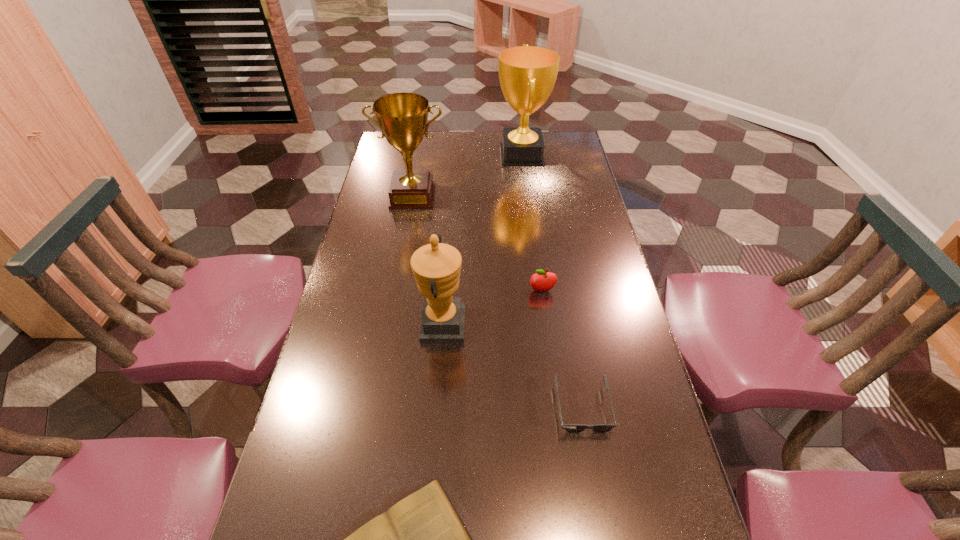
Locate an element on the screen. the rightmost award is located at coordinates (527, 74).

Image resolution: width=960 pixels, height=540 pixels. Find the location of `the farthest award`. the farthest award is located at coordinates [527, 74].

Identify the location of the second farthest award. This screenshot has height=540, width=960. (402, 117).

At what (x,y) coordinates should I click in order to perform the action: click on the fourth farthest object. Please return your answer as a coordinate pair (x, y). The width and height of the screenshot is (960, 540). Looking at the image, I should click on (436, 266).

You are a GUI agent. You are given a task and a screenshot of the screen. Output one action in this format:
    pyautogui.click(x=<x>, y=<y>)
    Task: Click on the third farthest object
    
    Given the screenshot: What is the action you would take?
    pyautogui.click(x=542, y=280)

The width and height of the screenshot is (960, 540). Identify the location of apple. (542, 280).

This screenshot has height=540, width=960. What are the coordinates of `sunglasses` in the screenshot? It's located at (x=571, y=428).

The image size is (960, 540). What are the coordinates of `the fifth tallest object` in the screenshot? It's located at (571, 428).

At what (x,y) coordinates should I click in order to perform the action: click on free space located 0.190m on the front-facing side of the farthest award. Please return your answer as a coordinate pair (x, y). Looking at the image, I should click on (450, 155).

The width and height of the screenshot is (960, 540). In order to click on blank space located on the front-facing side of the farthest award in this screenshot , I will do `click(410, 155)`.